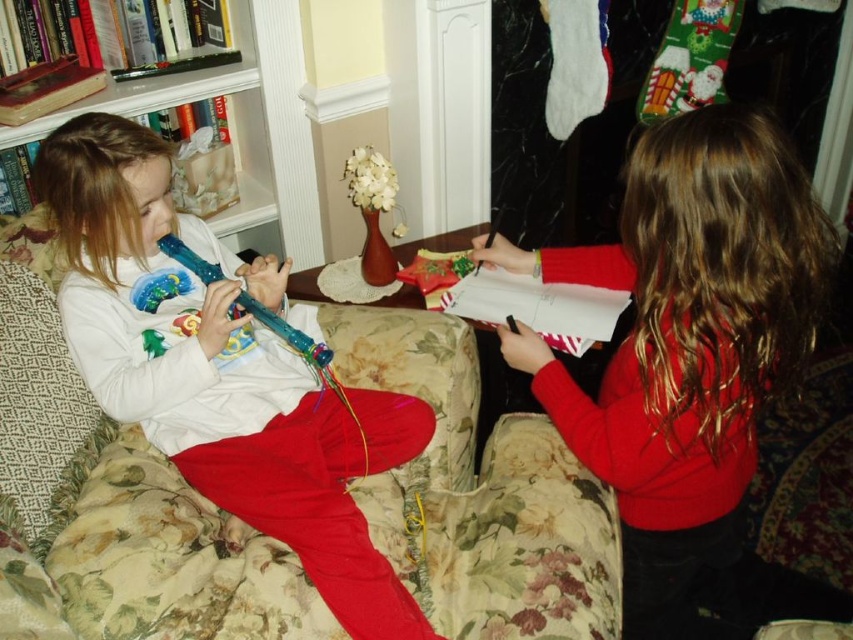
Does matte red sweater at right have a greater width compared to translucent plastic flute at left?

Correct, the width of matte red sweater at right exceeds that of translucent plastic flute at left.

Which is behind, point (790, 328) or point (144, 301)?

Positioned behind is point (144, 301).

At what (x,y) coordinates should I click in order to perform the action: click on matte red sweater at right. Please return your answer as a coordinate pair (x, y). Looking at the image, I should click on (692, 364).